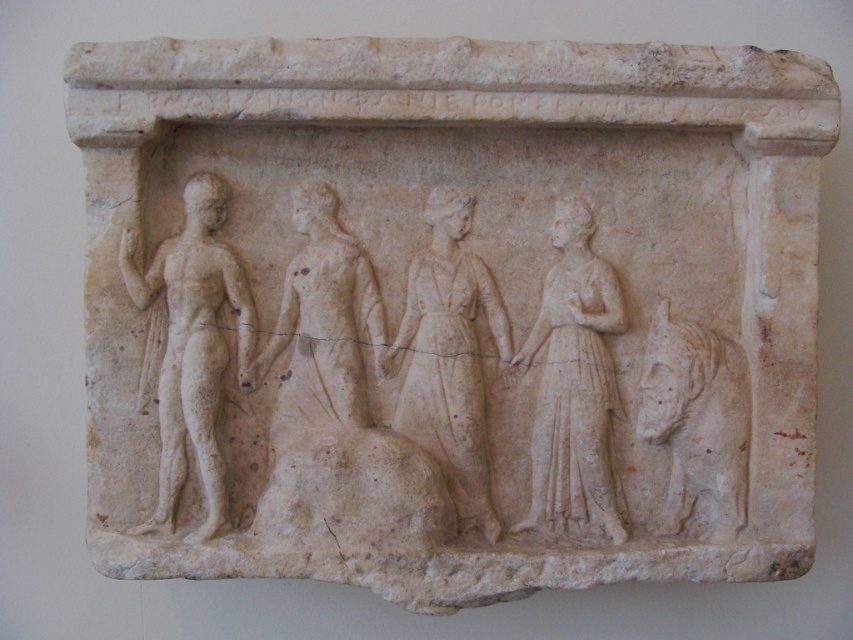
You are an art conservator examining the relief sculpture. You notice the smooth white figure at left and the white marble figure at center. Which figure is positioned in a way that it appears nearer to you?

The smooth white figure at left is closer to the viewer than the white marble figure at center, so it appears nearer.

You are an archaeologist examining an ancient relief sculpture. You notice two figures, the smooth white figure at left and the smooth white figure at center. Which one is located to the right?

The smooth white figure at center is located to the right of the smooth white figure at left.

Based on the scene description, which object is positioned higher in the image? The smooth white figure at left or the white marble figure at center?

The smooth white figure at left is positioned higher than the white marble figure at center according to the description.